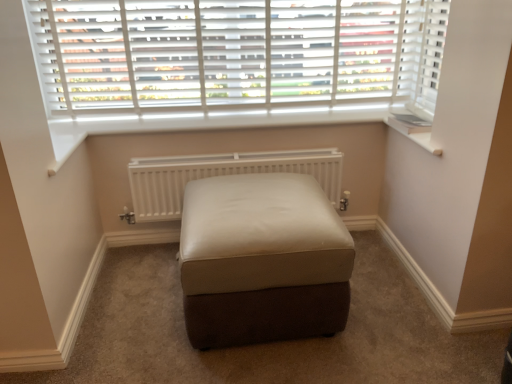
Question: Considering their positions, is leather ottoman at center located in front of or behind white matte radiator at center?

Choices:
 (A) front
 (B) behind

Answer: (A)

Question: From a real-world perspective, is leather ottoman at center positioned above or below white matte radiator at center?

Choices:
 (A) above
 (B) below

Answer: (B)

Question: Based on their relative distances, which object is nearer to the leather ottoman at center?

Choices:
 (A) white matte radiator at center
 (B) white wood blinds at upper center
 (C) white plastic window sill at upper right

Answer: (A)

Question: Which object is the farthest from the white wood blinds at upper center?

Choices:
 (A) leather ottoman at center
 (B) white matte radiator at center
 (C) white plastic window sill at upper right

Answer: (A)